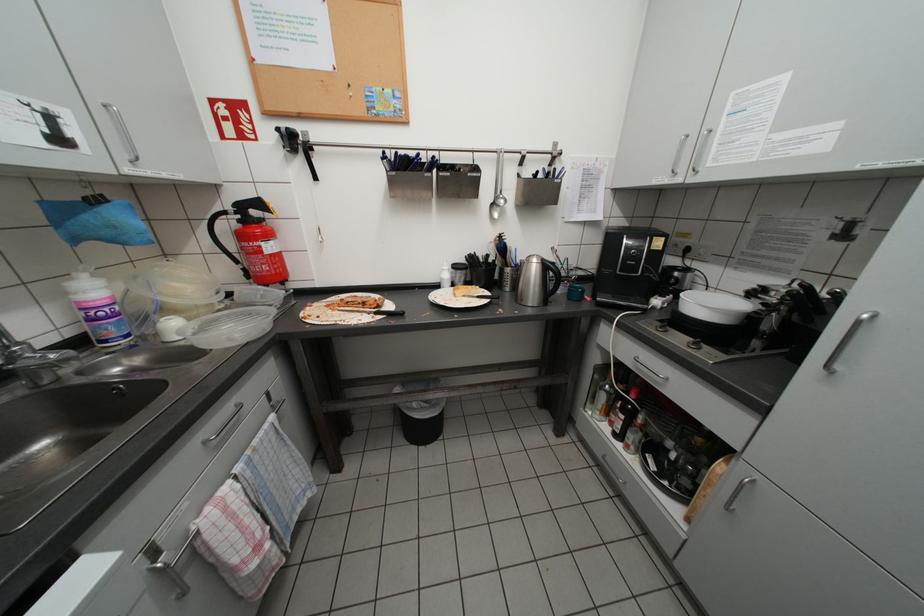
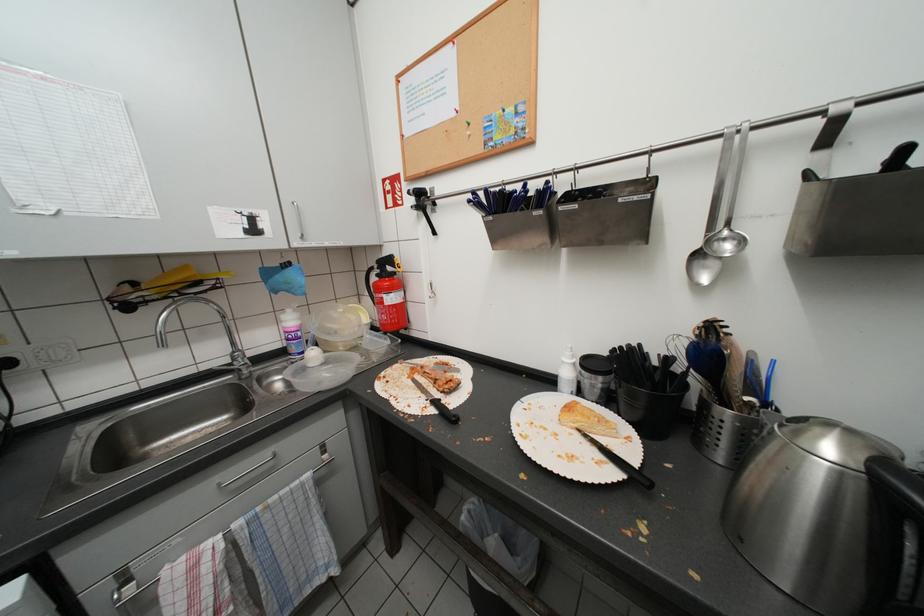
Question: The camera is either moving clockwise (left) or counter-clockwise (right) around the object. The first image is from the beginning of the video and the second image is from the end. Is the camera moving left or right when shooting the video?

Choices:
 (A) Left
 (B) Right

Answer: (B)